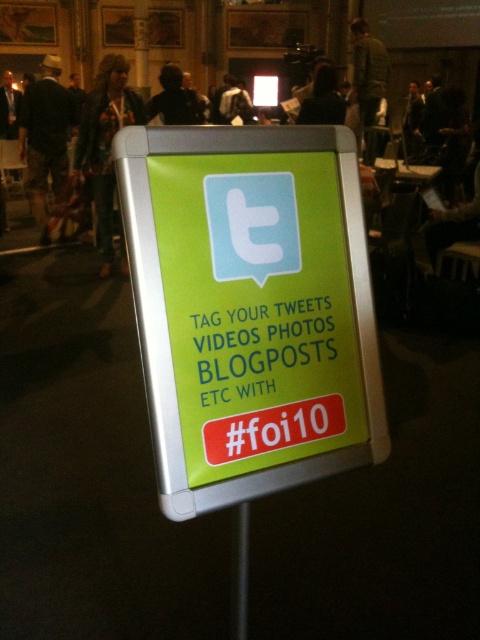
Question: Which of these objects is positioned closest to the leather jacket at upper left?

Choices:
 (A) black fabric at upper center
 (B) denim shorts at left

Answer: (A)

Question: Can you confirm if leather jacket at upper left is positioned above denim shorts at left?

Choices:
 (A) yes
 (B) no

Answer: (B)

Question: Which of the following is the closest to the observer?

Choices:
 (A) (168, 68)
 (B) (108, 70)
 (C) (40, 154)
 (D) (289, 177)

Answer: (D)

Question: Is leather jacket at upper left smaller than black fabric at upper center?

Choices:
 (A) yes
 (B) no

Answer: (B)

Question: Considering the real-world distances, which object is farthest from the denim shorts at left?

Choices:
 (A) green plastic sign at center
 (B) leather jacket at upper left

Answer: (A)

Question: Is the position of green plastic sign at center less distant than that of leather jacket at upper left?

Choices:
 (A) no
 (B) yes

Answer: (B)